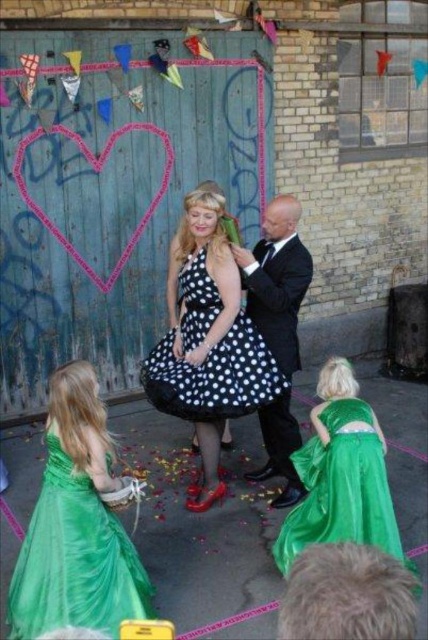
Question: Which of the following is the farthest from the observer?

Choices:
 (A) (171, 349)
 (B) (97, 595)

Answer: (A)

Question: Can you confirm if black polka dot dress at center is positioned below shiny black suit at center?

Choices:
 (A) yes
 (B) no

Answer: (B)

Question: Which point appears farthest from the camera in this image?

Choices:
 (A) (152, 364)
 (B) (26, 572)
 (C) (360, 461)

Answer: (A)

Question: From the image, what is the correct spatial relationship of green satin dress at lower left in relation to black polka dot dress at center?

Choices:
 (A) above
 (B) below

Answer: (B)

Question: Which point is farther to the camera?

Choices:
 (A) shiny black suit at center
 (B) black polka dot dress at center
 (C) green satin dress at lower right

Answer: (A)

Question: Is green satin dress at lower left bigger than shiny black suit at center?

Choices:
 (A) yes
 (B) no

Answer: (B)